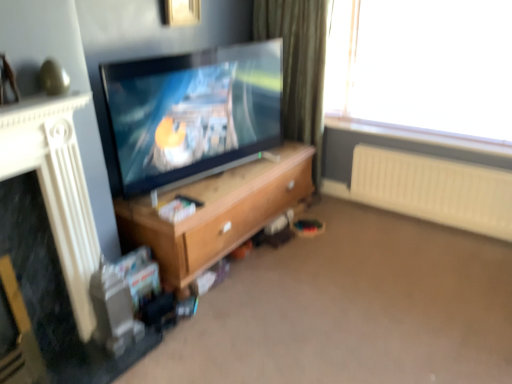
Question: Considering the relative positions of green fabric curtain at upper right and matte black tv at center in the image provided, is green fabric curtain at upper right to the left or to the right of matte black tv at center?

Choices:
 (A) right
 (B) left

Answer: (A)

Question: Looking at the image, does green fabric curtain at upper right seem bigger or smaller compared to matte black tv at center?

Choices:
 (A) big
 (B) small

Answer: (A)

Question: Which object is positioned farthest from the wooden cabinet at center?

Choices:
 (A) metallic gold picture frame at upper center
 (B) white plastic radiator at right
 (C) matte black tv at center
 (D) green fabric curtain at upper right
 (E) wooden tv stand at center

Answer: (A)

Question: Which is nearer to the matte black tv at center?

Choices:
 (A) metallic gold picture frame at upper center
 (B) white textured fireplace at left
 (C) white plastic radiator at right
 (D) wooden tv stand at center
 (E) wooden cabinet at center

Answer: (E)